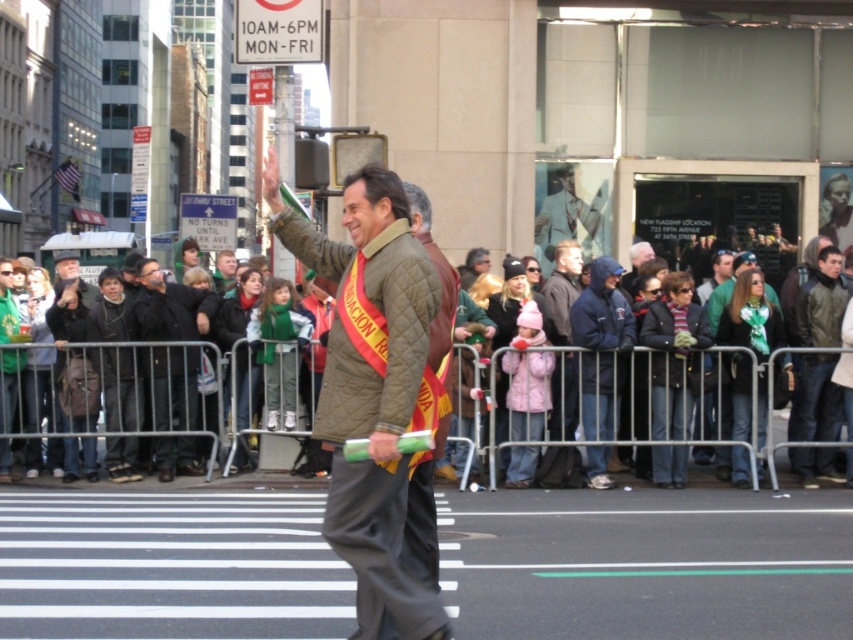
Question: Among these objects, which one is farthest from the camera?

Choices:
 (A) black quilted jacket at center
 (B) dark gray jacket at left
 (C) dark blue jeans at center

Answer: (A)

Question: Is black quilted jacket at center further to camera compared to leather jacket at center?

Choices:
 (A) no
 (B) yes

Answer: (B)

Question: Estimate the real-world distances between objects in this image. Which object is closer to the leather jacket at center?

Choices:
 (A) dark gray jacket at left
 (B) quilted brown jacket at center
 (C) green wool scarf at center

Answer: (B)

Question: Can you confirm if black quilted jacket at center is thinner than green wool scarf at center?

Choices:
 (A) yes
 (B) no

Answer: (A)

Question: Can you confirm if quilted brown jacket at center is thinner than black quilted jacket at center?

Choices:
 (A) yes
 (B) no

Answer: (B)

Question: Based on their relative distances, which object is farther from the dark gray jacket at left?

Choices:
 (A) black quilted jacket at center
 (B) leather jacket at center
 (C) quilted brown jacket at center
 (D) dark blue jeans at center

Answer: (D)